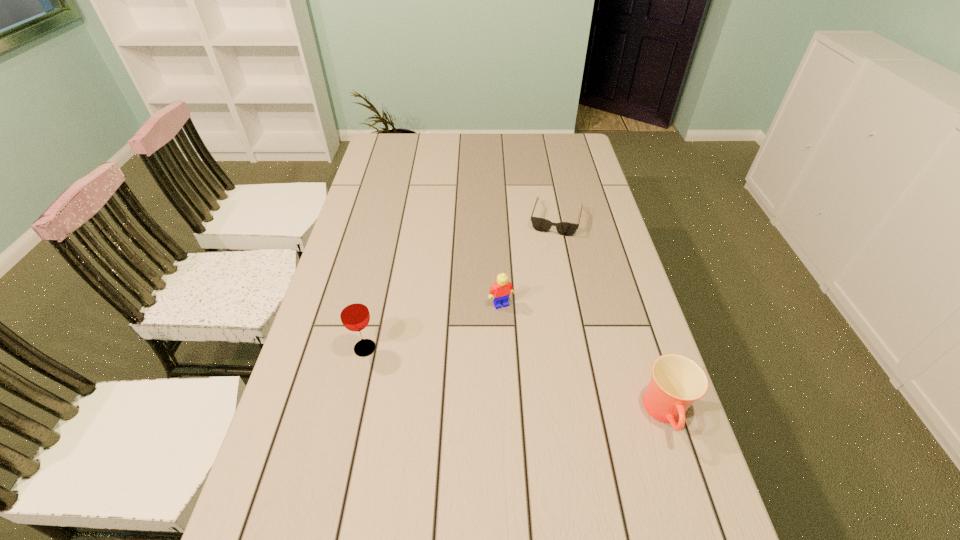
Identify the location of the second nearest object. (354, 313).

You are a GUI agent. You are given a task and a screenshot of the screen. Output one action in this format:
    pyautogui.click(x=<x>, y=<y>)
    Task: Click on the leftmost object
    
    Given the screenshot: What is the action you would take?
    pyautogui.click(x=354, y=313)

I want to click on the rightmost object, so click(677, 381).

Image resolution: width=960 pixels, height=540 pixels. Identify the location of cup. (677, 381).

I want to click on sunglasses, so click(x=540, y=224).

Find the location of a particular element. This screenshot has width=960, height=540. the second object from right to left is located at coordinates (540, 224).

Locate an element on the screen. This screenshot has width=960, height=540. Lego is located at coordinates (500, 292).

Identify the location of the second object from left to right. Image resolution: width=960 pixels, height=540 pixels. (500, 292).

Where is `free point located on the front of the second nearest object`? The height and width of the screenshot is (540, 960). free point located on the front of the second nearest object is located at coordinates (324, 532).

Where is `vacant space located 0.200m on the back of the rightmost object`? This screenshot has height=540, width=960. vacant space located 0.200m on the back of the rightmost object is located at coordinates (x=636, y=320).